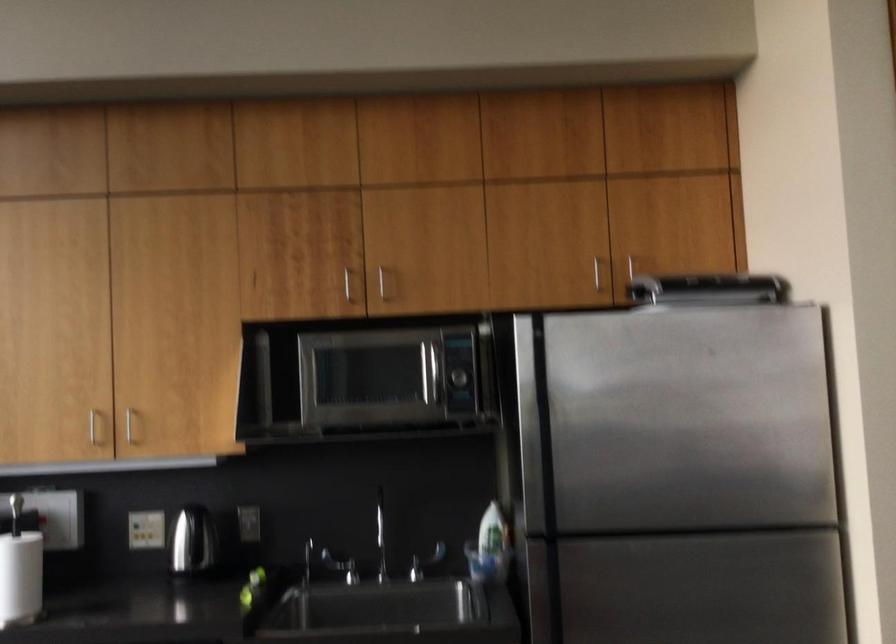
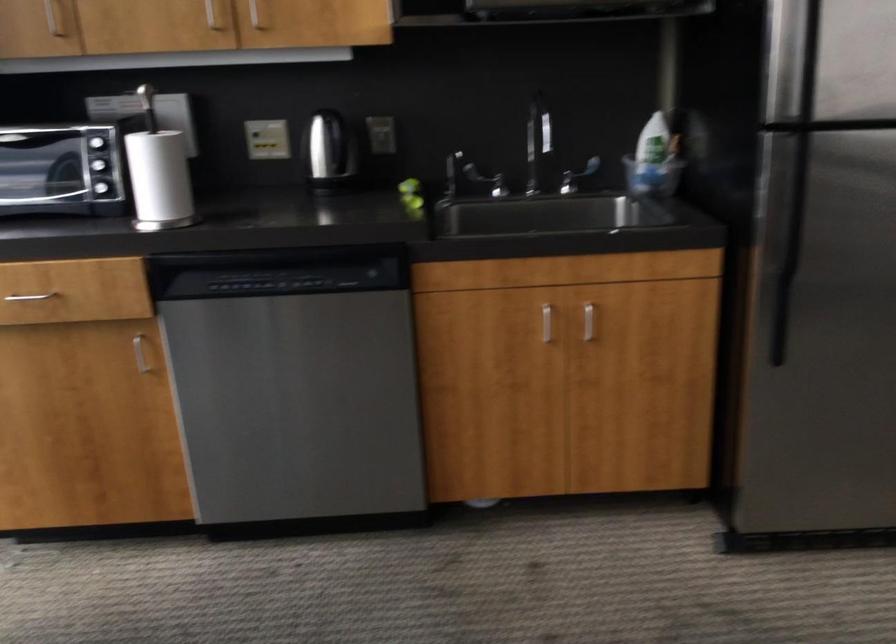
Question: Based on the continuous images, in which direction is the camera rotating? Reply with the corresponding letter.

Choices:
 (A) Left
 (B) Right
 (C) Up
 (D) Down

Answer: (D)